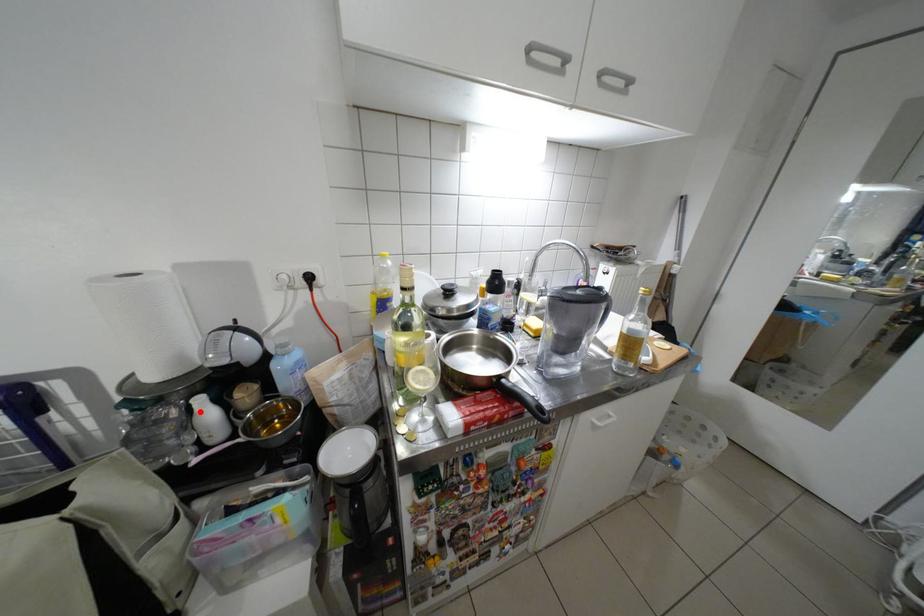
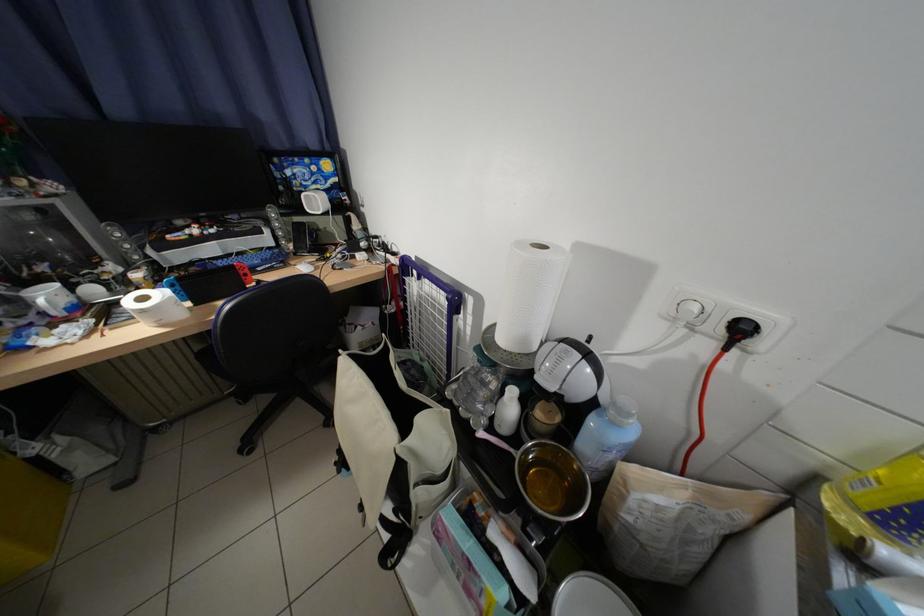
In the second image, find the point that corresponds to the highlighted location in the first image.

(514, 392)